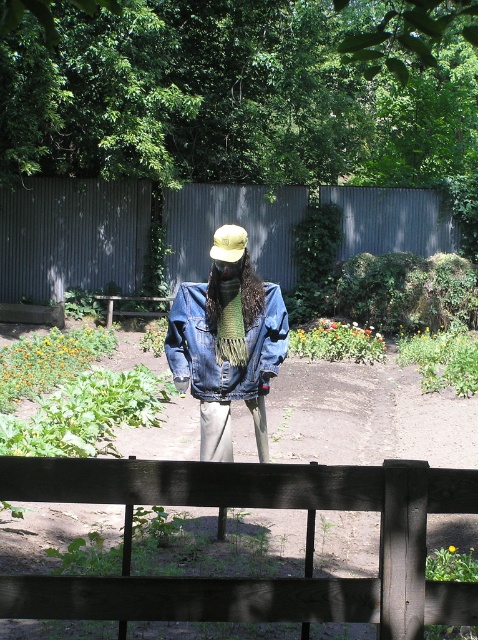
Consider the image. You are a gardener who wants to hang a bird feeder on a pole that is 1.2 meters tall. You see the denim jacket at center and the wooden park bench at center in the garden. Which object can the bird feeder pole be placed next to so it is not blocked by the object?

The bird feeder pole should be placed next to the wooden park bench at center because the denim jacket at center is taller than the wooden park bench at center, so the pole might be blocked by the denim jacket at center.